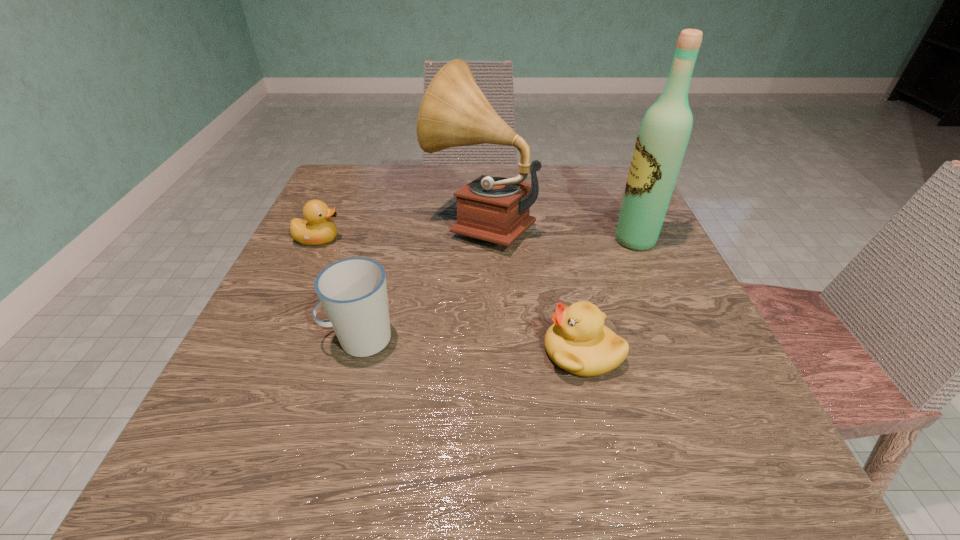
Locate an element on the screen. The image size is (960, 540). empty space that is in between the phonograph record and the tallest object is located at coordinates point(558,231).

The image size is (960, 540). I want to click on object that ranks as the second closest to the right duckling, so click(x=665, y=130).

Locate an element on the screen. Image resolution: width=960 pixels, height=540 pixels. object that is the third closest to the phonograph record is located at coordinates (317, 229).